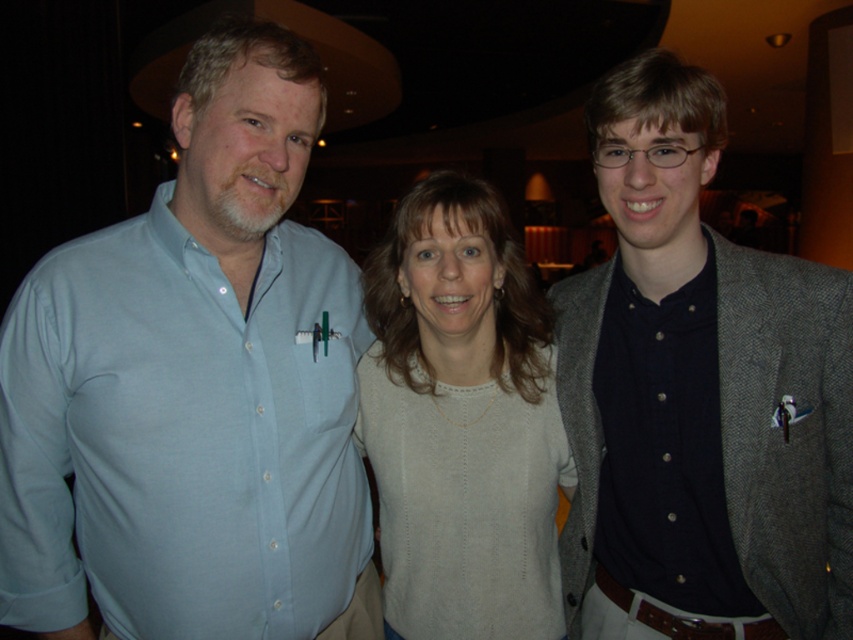
Question: Which object is the closest to the light gray sweater at center?

Choices:
 (A) light blue shirt at left
 (B) dark gray wool blazer at right

Answer: (B)

Question: Among these objects, which one is nearest to the camera?

Choices:
 (A) light gray sweater at center
 (B) dark gray wool blazer at right

Answer: (B)

Question: Does dark gray wool blazer at right have a larger size compared to light gray sweater at center?

Choices:
 (A) yes
 (B) no

Answer: (A)

Question: Is light blue shirt at left further to camera compared to light gray sweater at center?

Choices:
 (A) yes
 (B) no

Answer: (B)

Question: Does light blue shirt at left have a greater width compared to light gray sweater at center?

Choices:
 (A) no
 (B) yes

Answer: (B)

Question: Which object is positioned closest to the light blue shirt at left?

Choices:
 (A) dark gray wool blazer at right
 (B) light gray sweater at center

Answer: (B)